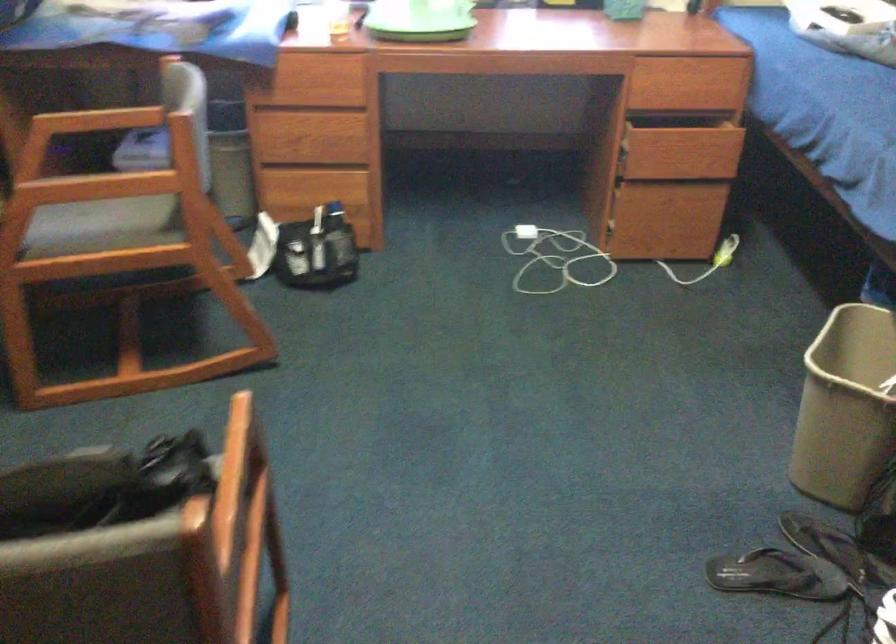
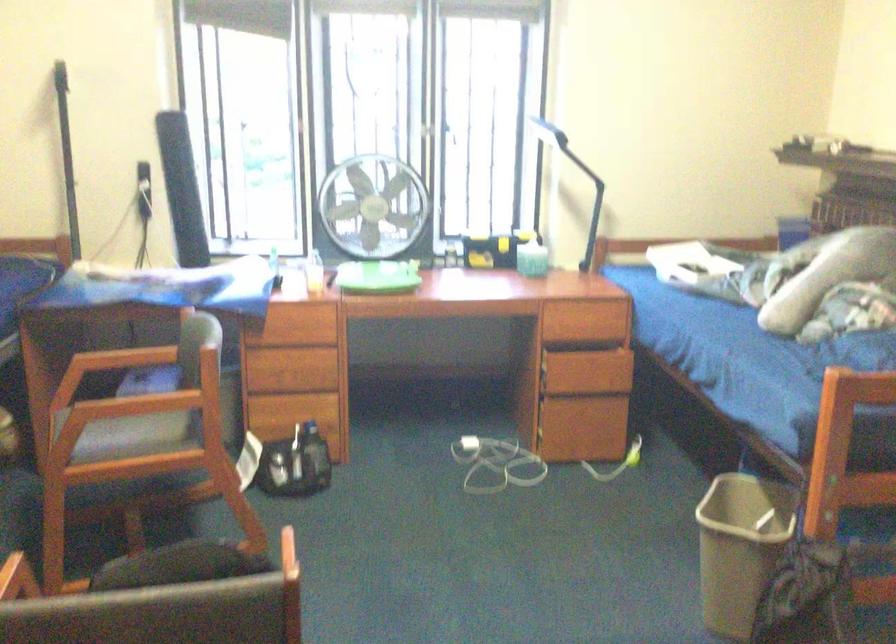
Where in the second image is the point corresponding to the point at 331,73 from the first image?

(306, 319)